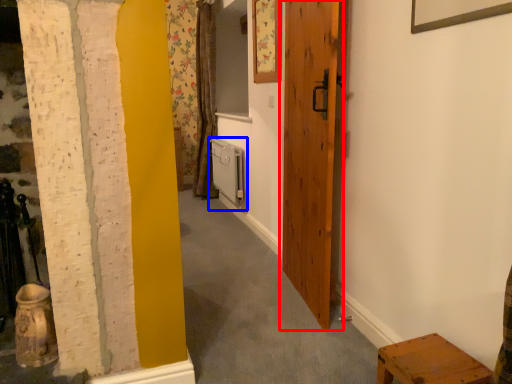
Question: Which point is further to the camera, door (highlighted by a red box) or radiator (highlighted by a blue box)?

Choices:
 (A) door
 (B) radiator

Answer: (B)